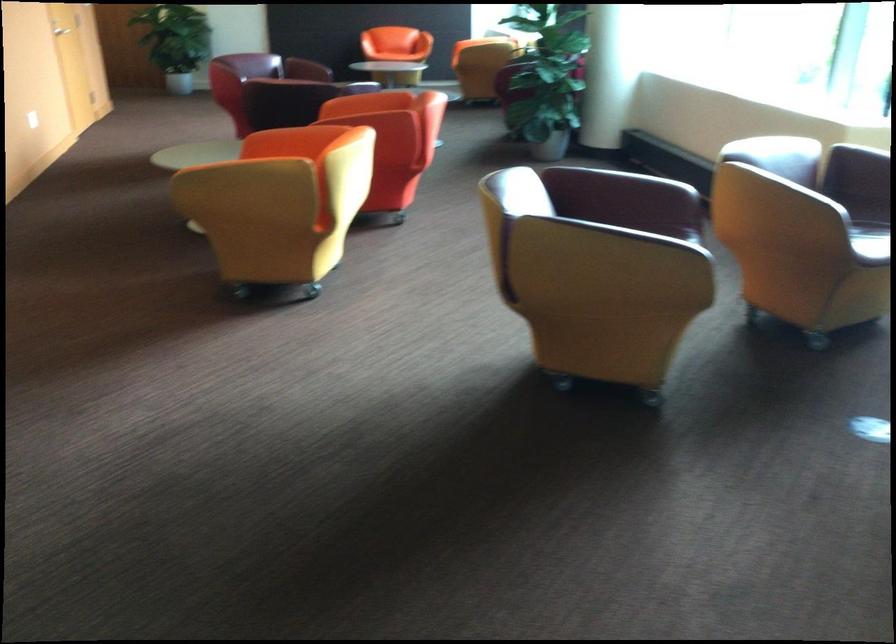
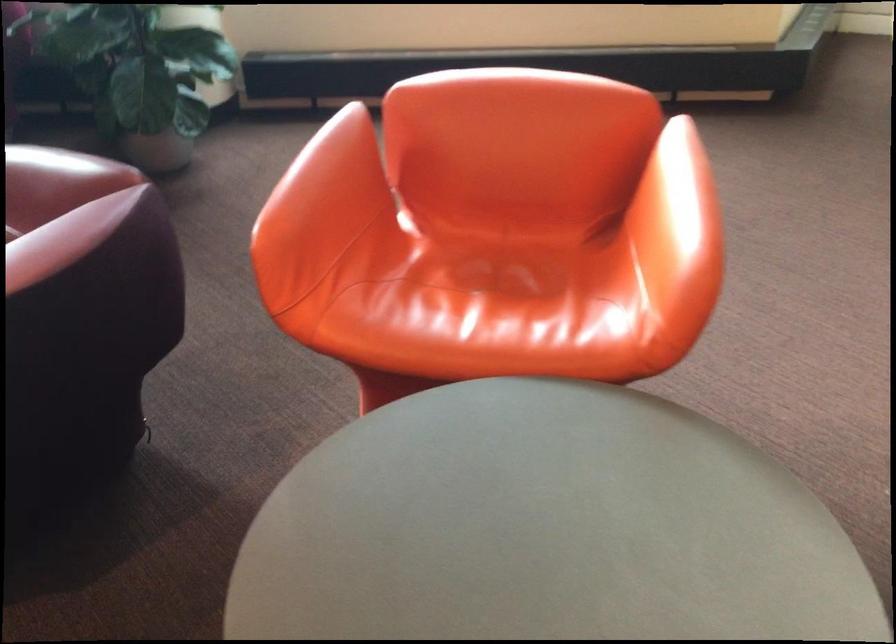
Locate, in the second image, the point that corresponds to the point at 371,88 in the first image.

(321, 192)